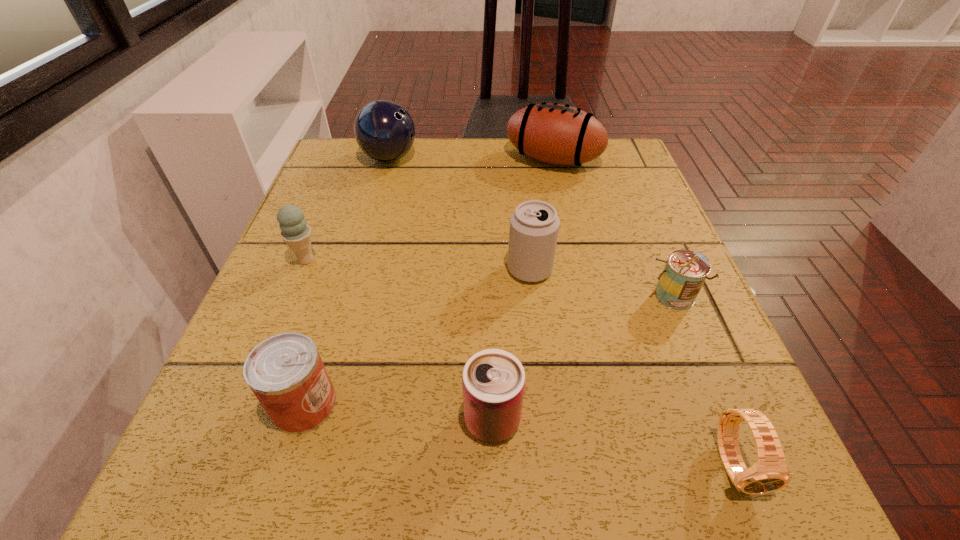
You are a GUI agent. You are given a task and a screenshot of the screen. Output one action in this format:
    pyautogui.click(x=<x>, y=<y>)
    Task: Click on the vacant area that lies between the shortest object and the rightmost can
    
    Given the screenshot: What is the action you would take?
    pyautogui.click(x=704, y=380)

Locate an element on the screen. Image resolution: width=960 pixels, height=540 pixels. free space between the football (American) and the watch is located at coordinates (644, 312).

You are a GUI agent. You are given a task and a screenshot of the screen. Output one action in this format:
    pyautogui.click(x=<x>, y=<y>)
    Task: Click on the vacant area that lies between the bowling ball and the shortest object
    This screenshot has width=960, height=540.
    Given the screenshot: What is the action you would take?
    pyautogui.click(x=562, y=311)

In order to click on vacant space that's between the bowling ball and the ice cream in this screenshot , I will do `click(348, 210)`.

This screenshot has width=960, height=540. I want to click on empty location between the ice cream and the leftmost can, so click(x=305, y=333).

Identify the location of object that ranks as the second closest to the leftmost can. The image size is (960, 540). (297, 234).

Where is `object that ranks as the third closest to the leftmost object`? Image resolution: width=960 pixels, height=540 pixels. object that ranks as the third closest to the leftmost object is located at coordinates (534, 225).

The height and width of the screenshot is (540, 960). I want to click on can that stands as the second closest to the bowling ball, so click(x=285, y=372).

Image resolution: width=960 pixels, height=540 pixels. I want to click on the closest can to the leftmost can, so click(x=493, y=382).

This screenshot has width=960, height=540. Find the location of `vacant area that satisfies the following two spatial constraints: 1. on the surface of the bowling ball near the finger holes; 2. on the left side of the rightmost can`. vacant area that satisfies the following two spatial constraints: 1. on the surface of the bowling ball near the finger holes; 2. on the left side of the rightmost can is located at coordinates coord(350,297).